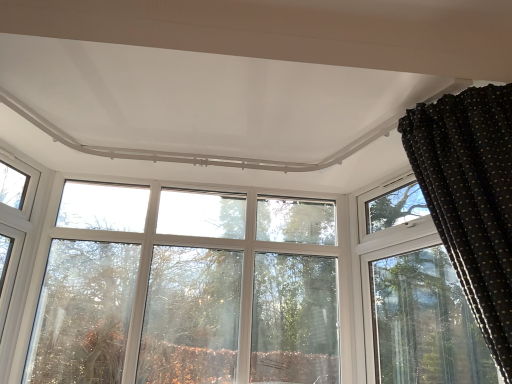
Question: Is transparent glass tree at center a part of black dotted fabric at upper right?

Choices:
 (A) yes
 (B) no

Answer: (B)

Question: Is black dotted fabric at upper right aimed at transparent glass tree at center?

Choices:
 (A) yes
 (B) no

Answer: (B)

Question: From the image's perspective, would you say black dotted fabric at upper right is shown under transparent glass tree at center?

Choices:
 (A) yes
 (B) no

Answer: (B)

Question: Is black dotted fabric at upper right at the right side of transparent glass tree at center?

Choices:
 (A) no
 (B) yes

Answer: (B)

Question: Can you confirm if black dotted fabric at upper right is bigger than transparent glass tree at center?

Choices:
 (A) yes
 (B) no

Answer: (A)

Question: Based on their sizes in the image, would you say black dotted fabric at upper right is bigger or smaller than clear glass window at upper left?

Choices:
 (A) big
 (B) small

Answer: (A)

Question: Relative to clear glass window at upper left, is black dotted fabric at upper right in front or behind?

Choices:
 (A) behind
 (B) front

Answer: (B)

Question: Considering the relative positions of black dotted fabric at upper right and clear glass window at upper left in the image provided, is black dotted fabric at upper right to the left or to the right of clear glass window at upper left?

Choices:
 (A) right
 (B) left

Answer: (A)

Question: Is point (415, 168) closer or farther from the camera than point (5, 208)?

Choices:
 (A) farther
 (B) closer

Answer: (B)

Question: Considering the positions of clear glass window at upper left and black dotted fabric at upper right in the image, is clear glass window at upper left wider or thinner than black dotted fabric at upper right?

Choices:
 (A) wide
 (B) thin

Answer: (B)

Question: Considering the positions of clear glass window at upper left and black dotted fabric at upper right in the image, is clear glass window at upper left taller or shorter than black dotted fabric at upper right?

Choices:
 (A) tall
 (B) short

Answer: (A)

Question: From the image's perspective, is clear glass window at upper left located above or below black dotted fabric at upper right?

Choices:
 (A) below
 (B) above

Answer: (A)

Question: In the image, is clear glass window at upper left positioned in front of or behind black dotted fabric at upper right?

Choices:
 (A) front
 (B) behind

Answer: (B)

Question: Considering the positions of point (192, 372) and point (465, 215), is point (192, 372) closer or farther from the camera than point (465, 215)?

Choices:
 (A) closer
 (B) farther

Answer: (B)

Question: From the image's perspective, is transparent glass tree at center positioned above or below black dotted fabric at upper right?

Choices:
 (A) below
 (B) above

Answer: (A)